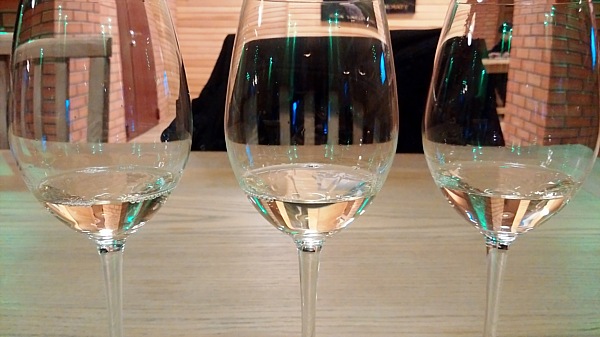
Where is `chair back`? The width and height of the screenshot is (600, 337). chair back is located at coordinates [x=80, y=47].